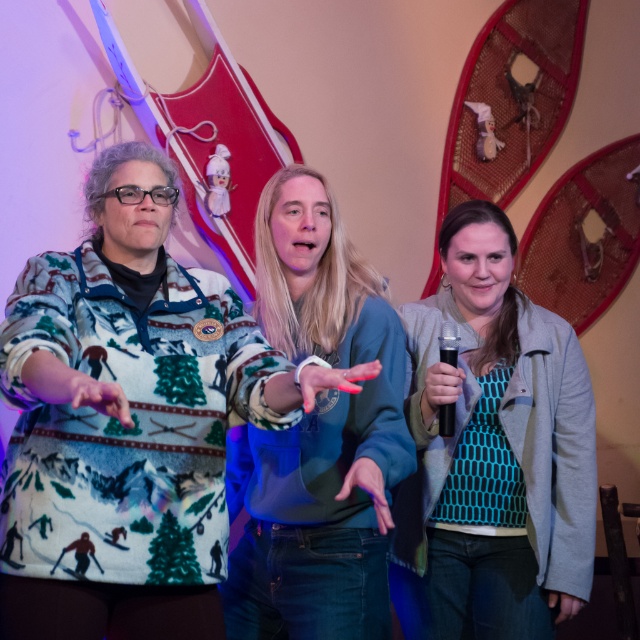
Question: Does teal dotted sweater at center have a greater width compared to green fuzzy sweater at center?

Choices:
 (A) yes
 (B) no

Answer: (A)

Question: Can you confirm if teal dotted sweater at center is positioned below green fuzzy sweater at center?

Choices:
 (A) yes
 (B) no

Answer: (A)

Question: Does teal dotted sweater at center have a smaller size compared to green fuzzy sweater at center?

Choices:
 (A) yes
 (B) no

Answer: (A)

Question: Which of the following is the farthest from the observer?

Choices:
 (A) teal dotted sweater at center
 (B) green fuzzy sweater at center

Answer: (A)

Question: Which of the following is the farthest from the observer?

Choices:
 (A) green fuzzy sweater at center
 (B) teal dotted sweater at center

Answer: (B)